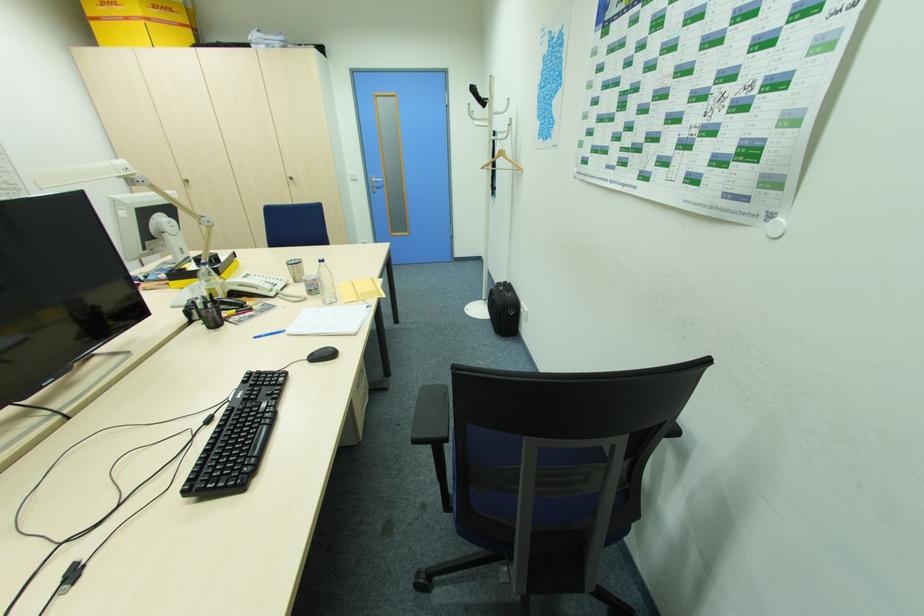
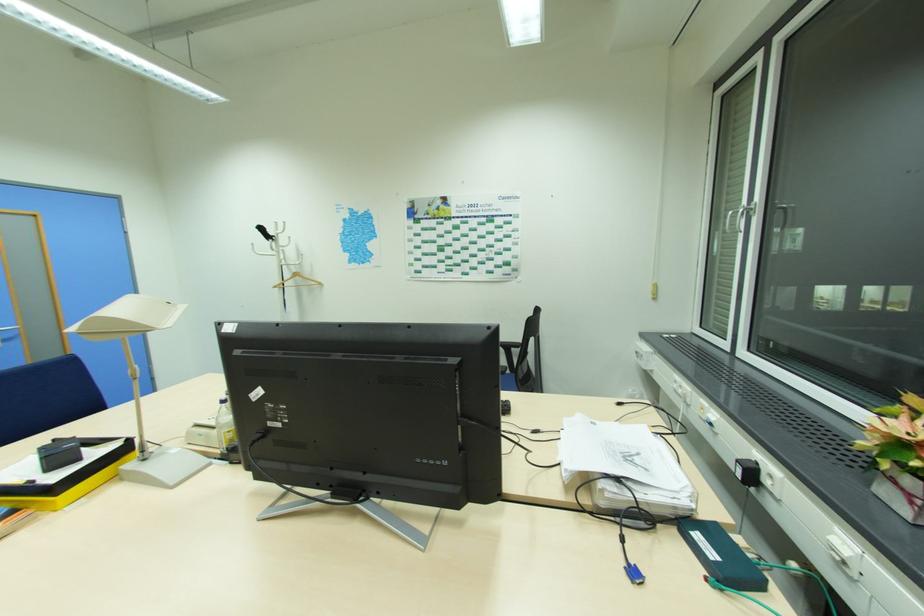
The point at [485,168] is marked in the first image. Where is the corresponding point in the second image?

(277, 286)